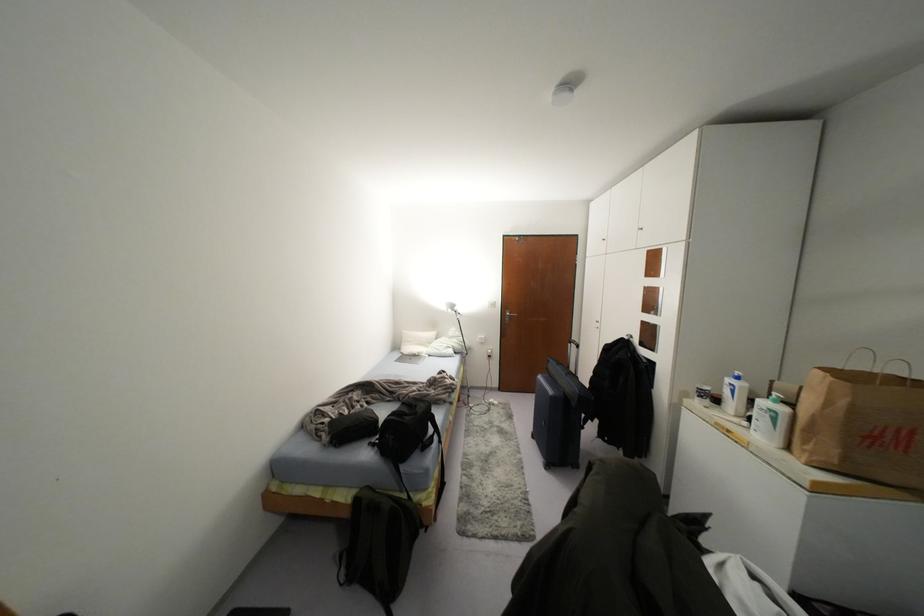
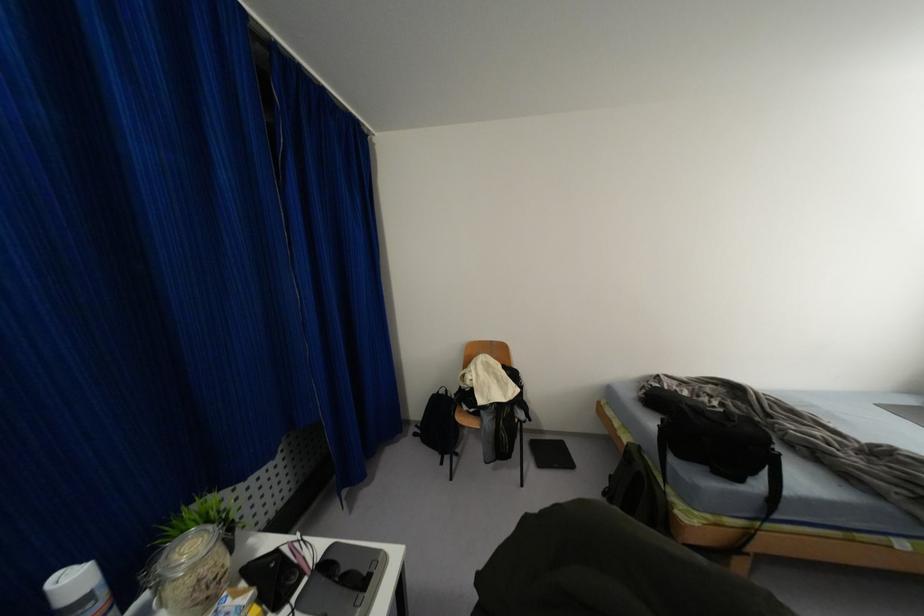
Question: The camera is either moving clockwise (left) or counter-clockwise (right) around the object. The first image is from the beginning of the video and the second image is from the end. Is the camera moving left or right when shooting the video?

Choices:
 (A) Left
 (B) Right

Answer: (B)